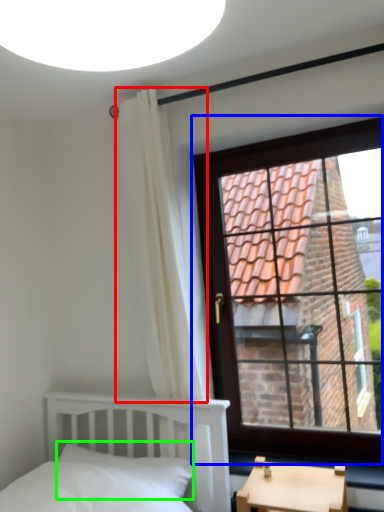
Question: Which object is positioned farthest from curtain (highlighted by a red box)? Select from window (highlighted by a blue box) and pillow (highlighted by a green box).

Choices:
 (A) window
 (B) pillow

Answer: (A)